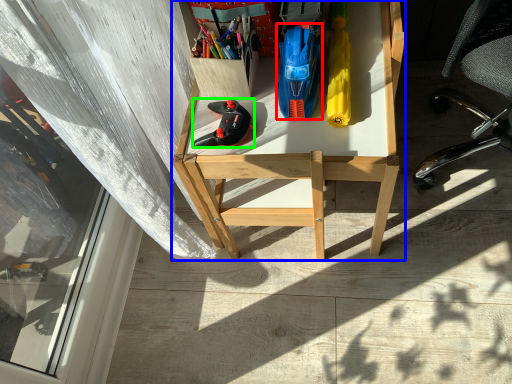
Question: Which is nearer to the stationery (highlighted by a red box)? desk (highlighted by a blue box) or footwear (highlighted by a green box).

Choices:
 (A) desk
 (B) footwear

Answer: (B)